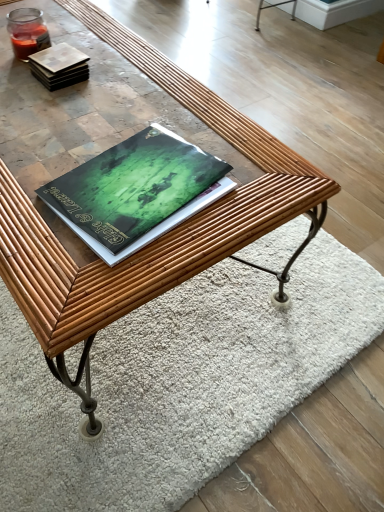
Question: Can you confirm if green matte book at center, which is counted as the first book, starting from the front, is positioned to the left of rug at center?

Choices:
 (A) yes
 (B) no

Answer: (A)

Question: Is green matte book at center, acting as the second book starting from the back, facing towards rug at center?

Choices:
 (A) no
 (B) yes

Answer: (A)

Question: Does green matte book at center, acting as the second book starting from the back, have a smaller size compared to rug at center?

Choices:
 (A) yes
 (B) no

Answer: (A)

Question: Is green matte book at center, acting as the second book starting from the back, in front of rug at center?

Choices:
 (A) yes
 (B) no

Answer: (A)

Question: Is rug at center surrounded by green matte book at center, the 2th book viewed from the top?

Choices:
 (A) no
 (B) yes

Answer: (A)

Question: From a real-world perspective, relative to green matte book at center, acting as the second book starting from the back, is matte brown tile at upper left, which is the 2th book in bottom-to-top order, vertically above or below?

Choices:
 (A) above
 (B) below

Answer: (A)

Question: From the image's perspective, is matte brown tile at upper left, arranged as the 2th book when viewed from the front, located above or below green matte book at center, which is counted as the first book, starting from the front?

Choices:
 (A) below
 (B) above

Answer: (B)

Question: Is matte brown tile at upper left, which is the 2th book in bottom-to-top order, in front of or behind green matte book at center, acting as the second book starting from the back, in the image?

Choices:
 (A) front
 (B) behind

Answer: (B)

Question: Would you say matte brown tile at upper left, which is the 2th book in bottom-to-top order, is inside or outside green matte book at center, the 1th book ordered from the bottom?

Choices:
 (A) outside
 (B) inside

Answer: (A)

Question: Based on their sizes in the image, would you say rug at center is bigger or smaller than matte brown tile at upper left, arranged as the 1th book when viewed from the back?

Choices:
 (A) small
 (B) big

Answer: (B)

Question: Would you say rug at center is to the left or to the right of matte brown tile at upper left, arranged as the 1th book when viewed from the back, in the picture?

Choices:
 (A) right
 (B) left

Answer: (A)

Question: From the image's perspective, is rug at center above or below matte brown tile at upper left, arranged as the 1th book when viewed from the back?

Choices:
 (A) below
 (B) above

Answer: (A)

Question: Is point (261, 306) closer or farther from the camera than point (34, 58)?

Choices:
 (A) farther
 (B) closer

Answer: (A)

Question: Does point (130, 164) appear closer or farther from the camera than point (23, 385)?

Choices:
 (A) farther
 (B) closer

Answer: (B)

Question: Would you say green matte book at center, the 2th book viewed from the top, is inside or outside rug at center?

Choices:
 (A) outside
 (B) inside

Answer: (A)